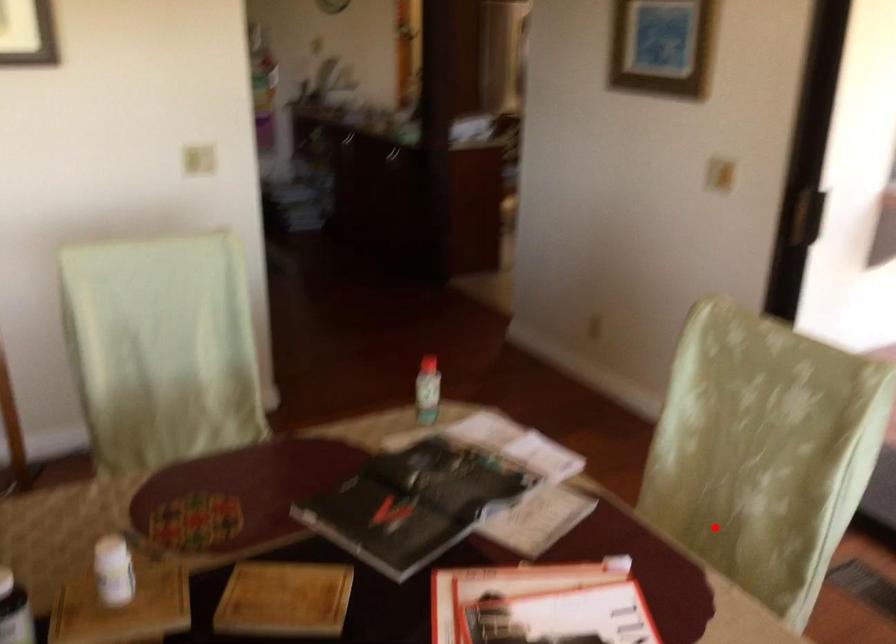
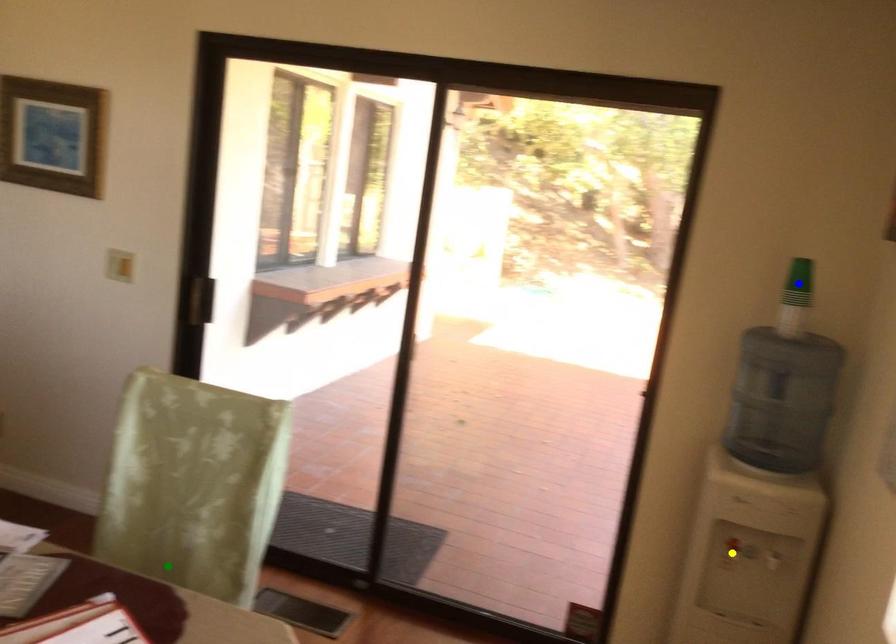
Question: I am providing you with two images of the same scene from different viewpoints. A red point is marked on the first image. You are given multiple points on the second image. In image 2, which mark is for the same physical point as the one in image 1?

Choices:
 (A) blue point
 (B) green point
 (C) yellow point

Answer: (B)